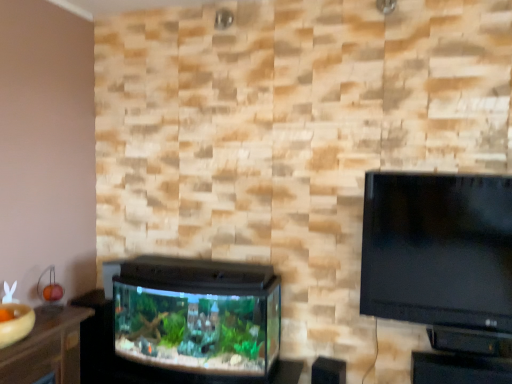
Identify the location of black plastic aquarium at lower left. (196, 316).

Considering the sizes of objects black plastic table at lower right and black plastic aquarium at lower left in the image provided, who is smaller, black plastic table at lower right or black plastic aquarium at lower left?

With smaller size is black plastic table at lower right.

Is black plastic table at lower right to the right of black plastic aquarium at lower left from the viewer's perspective?

Correct, you'll find black plastic table at lower right to the right of black plastic aquarium at lower left.

What's the angular difference between black plastic table at lower right and black plastic aquarium at lower left's facing directions?

black plastic table at lower right and black plastic aquarium at lower left are facing 1.34 degrees away from each other.

Considering the positions of objects black plastic aquarium at lower left and black plastic table at lower right in the image provided, who is in front, black plastic aquarium at lower left or black plastic table at lower right?

black plastic table at lower right is closer to the camera.

From a real-world perspective, between black plastic aquarium at lower left and black plastic table at lower right, who is vertically higher?

In real-world perspective, black plastic aquarium at lower left is above.

Looking at this image, considering the sizes of objects black plastic aquarium at lower left and black plastic table at lower right in the image provided, who is taller, black plastic aquarium at lower left or black plastic table at lower right?

With more height is black plastic aquarium at lower left.

Is black plastic aquarium at lower left turned away from black plastic table at lower right?

No, black plastic aquarium at lower left is not facing the opposite direction of black plastic table at lower right.

From a real-world perspective, is black plastic aquarium at lower left positioned over wooden table at lower left based on gravity?

No, from a real-world perspective, black plastic aquarium at lower left is not over wooden table at lower left

Is black plastic aquarium at lower left next to wooden table at lower left?

No, black plastic aquarium at lower left is not touching wooden table at lower left.

Between black plastic aquarium at lower left and wooden table at lower left, which one appears on the left side from the viewer's perspective?

From the viewer's perspective, wooden table at lower left appears more on the left side.

From the image's perspective, between black plastic aquarium at lower left and wooden table at lower left, who is located below?

wooden table at lower left appears lower in the image.

Considering the relative positions of wooden table at lower left and black plastic aquarium at lower left in the image provided, is wooden table at lower left to the left of black plastic aquarium at lower left from the viewer's perspective?

Correct, you'll find wooden table at lower left to the left of black plastic aquarium at lower left.

Based on the photo, considering the relative sizes of wooden table at lower left and black plastic aquarium at lower left in the image provided, is wooden table at lower left taller than black plastic aquarium at lower left?

No, wooden table at lower left is not taller than black plastic aquarium at lower left.

Which object is closer to the camera taking this photo, wooden table at lower left or black plastic aquarium at lower left?

wooden table at lower left is in front.

Considering the points (51, 306) and (247, 297), which point is behind, point (51, 306) or point (247, 297)?

The point (51, 306) is farther.

Which point is more forward, (54, 319) or (509, 383)?

The point (509, 383) is in front.

Can you tell me how much wooden table at lower left and black plastic table at lower right differ in facing direction?

They differ by 88.5 degrees in their facing directions.

Is wooden table at lower left looking in the opposite direction of black plastic table at lower right?

wooden table at lower left is not turned away from black plastic table at lower right.

Locate an element on the screen. The width and height of the screenshot is (512, 384). furniture in front of the black plastic table at lower right is located at coordinates pyautogui.click(x=46, y=348).

From a real-world perspective, who is located lower, black plastic table at lower right or wooden table at lower left?

black plastic table at lower right.

Does black plastic table at lower right turn towards wooden table at lower left?

No, black plastic table at lower right is not facing towards wooden table at lower left.

Is black plastic table at lower right next to wooden table at lower left and touching it?

No, black plastic table at lower right is not touching wooden table at lower left.

Looking at this image, between black plastic table at lower right and wooden table at lower left, which one has larger width?

wooden table at lower left is wider.

Find the location of `table in front of the black plastic aquarium at lower left`. table in front of the black plastic aquarium at lower left is located at coordinates (459, 369).

Where is `tv cabinet above the black plastic table at lower right (from a real-world perspective)`? Image resolution: width=512 pixels, height=384 pixels. tv cabinet above the black plastic table at lower right (from a real-world perspective) is located at coordinates (196, 316).

Looking at the image, which one is located closer to black plastic aquarium at lower left, wooden table at lower left or black plastic table at lower right?

wooden table at lower left is closer to black plastic aquarium at lower left.

From the image, which object appears to be nearer to wooden table at lower left, black plastic table at lower right or black plastic aquarium at lower left?

Based on the image, black plastic aquarium at lower left appears to be nearer to wooden table at lower left.

From the image, which object appears to be farther from wooden table at lower left, black plastic aquarium at lower left or black plastic table at lower right?

black plastic table at lower right is further to wooden table at lower left.

Which object lies nearer to the anchor point black plastic aquarium at lower left, black plastic table at lower right or wooden table at lower left?

wooden table at lower left.

Based on their spatial positions, is wooden table at lower left or black plastic aquarium at lower left closer to black plastic table at lower right?

black plastic aquarium at lower left.

Estimate the real-world distances between objects in this image. Which object is further from black plastic table at lower right, black plastic aquarium at lower left or wooden table at lower left?

wooden table at lower left is further to black plastic table at lower right.

This screenshot has width=512, height=384. What are the coordinates of `tv cabinet between wooden table at lower left and black plastic table at lower right from left to right` in the screenshot? It's located at (196, 316).